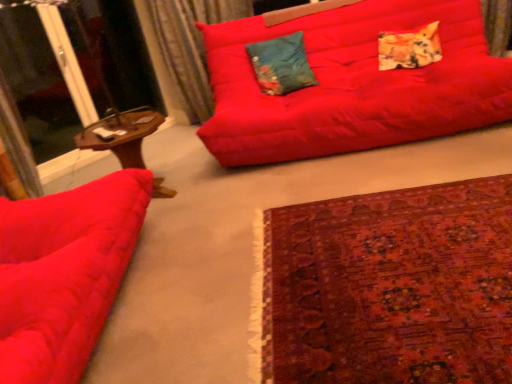
This screenshot has width=512, height=384. In order to click on vacant space that is in between woodenwoodentable at left and carpet with intricate patterns at lower right in this screenshot , I will do `click(233, 231)`.